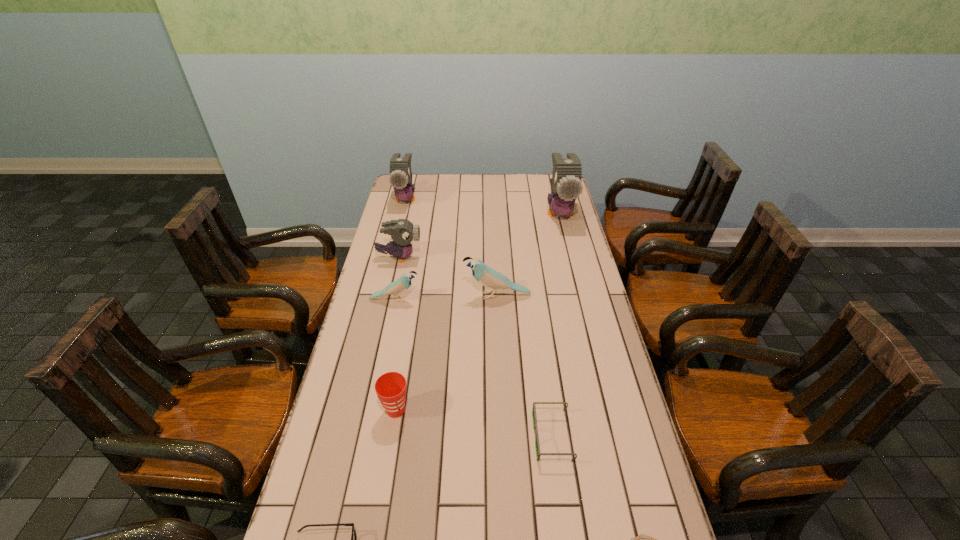
Find the location of a particular element. Image resolution: width=960 pixels, height=540 pixels. free space at the right edge of the desktop is located at coordinates (609, 350).

Locate an element on the screen. vacant region between the bigger blue bird and the smallest gray bird is located at coordinates pos(448,276).

Where is `free spot between the shortest bird and the cup`? Image resolution: width=960 pixels, height=540 pixels. free spot between the shortest bird and the cup is located at coordinates (396, 355).

This screenshot has width=960, height=540. I want to click on vacant space in between the second tallest bird and the fourth bird from left to right, so click(x=451, y=247).

Identify the location of vacant space in between the nearest gray bird and the bigger blue bird. (448, 276).

At what (x,y) coordinates should I click in order to perform the action: click on free space between the second tallest object and the cup. Please return your answer as a coordinate pair (x, y). The width and height of the screenshot is (960, 540). Looking at the image, I should click on (401, 305).

Identify the location of unoccupied area between the cup and the tallest bird. (478, 312).

Find the location of `object that is the fifth closest to the third nearest bird`. object that is the fifth closest to the third nearest bird is located at coordinates (390, 387).

Identify the location of object that is the fourth closest one to the black spectacles. (488, 277).

Where is `bird object that ranks as the third closest to the right blue bird`? bird object that ranks as the third closest to the right blue bird is located at coordinates (566, 185).